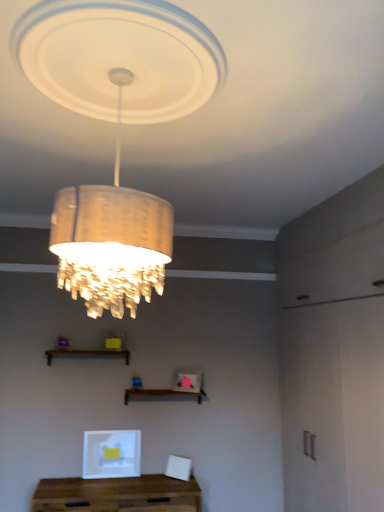
Question: Is wooden shelf at lower center, positioned as the 1th shelf in left-to-right order, beside wooden table at lower center?

Choices:
 (A) no
 (B) yes

Answer: (A)

Question: Is wooden shelf at lower center, the 2th shelf when ordered from bottom to top, smaller than wooden table at lower center?

Choices:
 (A) no
 (B) yes

Answer: (B)

Question: Does wooden shelf at lower center, the 2th shelf when ordered from bottom to top, have a lesser height compared to wooden table at lower center?

Choices:
 (A) yes
 (B) no

Answer: (A)

Question: Can you confirm if wooden shelf at lower center, acting as the 1th shelf starting from the top, is bigger than wooden table at lower center?

Choices:
 (A) yes
 (B) no

Answer: (B)

Question: From a real-world perspective, is wooden shelf at lower center, acting as the 1th shelf starting from the top, on wooden table at lower center?

Choices:
 (A) no
 (B) yes

Answer: (B)

Question: Is wooden shelf at lower center, acting as the 1th shelf starting from the top, behind wooden table at lower center?

Choices:
 (A) yes
 (B) no

Answer: (A)

Question: Is matte gold chandelier at upper center closer to the viewer compared to wooden shelf at lower center, the 2th shelf positioned from the right?

Choices:
 (A) yes
 (B) no

Answer: (A)

Question: Is matte gold chandelier at upper center looking in the opposite direction of wooden shelf at lower center, the 2th shelf positioned from the right?

Choices:
 (A) no
 (B) yes

Answer: (A)

Question: Considering the relative positions of matte gold chandelier at upper center and wooden shelf at lower center, the 2th shelf positioned from the right, in the image provided, is matte gold chandelier at upper center to the right of wooden shelf at lower center, the 2th shelf positioned from the right, from the viewer's perspective?

Choices:
 (A) no
 (B) yes

Answer: (B)

Question: Is matte gold chandelier at upper center further to the viewer compared to wooden shelf at lower center, the 2th shelf positioned from the right?

Choices:
 (A) yes
 (B) no

Answer: (B)

Question: Is matte gold chandelier at upper center at the left side of wooden shelf at lower center, the 2th shelf positioned from the right?

Choices:
 (A) no
 (B) yes

Answer: (A)

Question: Can you confirm if matte gold chandelier at upper center is thinner than wooden shelf at lower center, acting as the 1th shelf starting from the top?

Choices:
 (A) yes
 (B) no

Answer: (B)

Question: Considering the relative positions of brown wooden shelf at center, marked as the 2th shelf in a top-to-bottom arrangement, and wooden shelf at lower center, the 2th shelf positioned from the right, in the image provided, is brown wooden shelf at center, marked as the 2th shelf in a top-to-bottom arrangement, behind wooden shelf at lower center, the 2th shelf positioned from the right,?

Choices:
 (A) yes
 (B) no

Answer: (A)